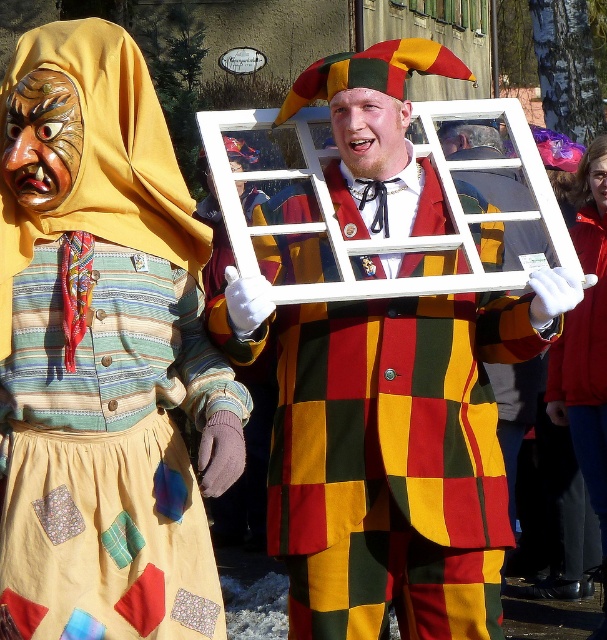
Question: Can you confirm if matte yellow hood at upper left is positioned to the left of matte wooden window frame at center?

Choices:
 (A) no
 (B) yes

Answer: (B)

Question: Is matte yellow hood at upper left smaller than matte wooden window frame at center?

Choices:
 (A) yes
 (B) no

Answer: (A)

Question: Is matte yellow hood at upper left positioned in front of matte wooden window frame at center?

Choices:
 (A) no
 (B) yes

Answer: (B)

Question: Which object appears farthest from the camera in this image?

Choices:
 (A) matte yellow hood at upper left
 (B) matte wooden window frame at center

Answer: (B)

Question: Which point is farther to the camera?

Choices:
 (A) matte wooden window frame at center
 (B) matte yellow hood at upper left

Answer: (A)